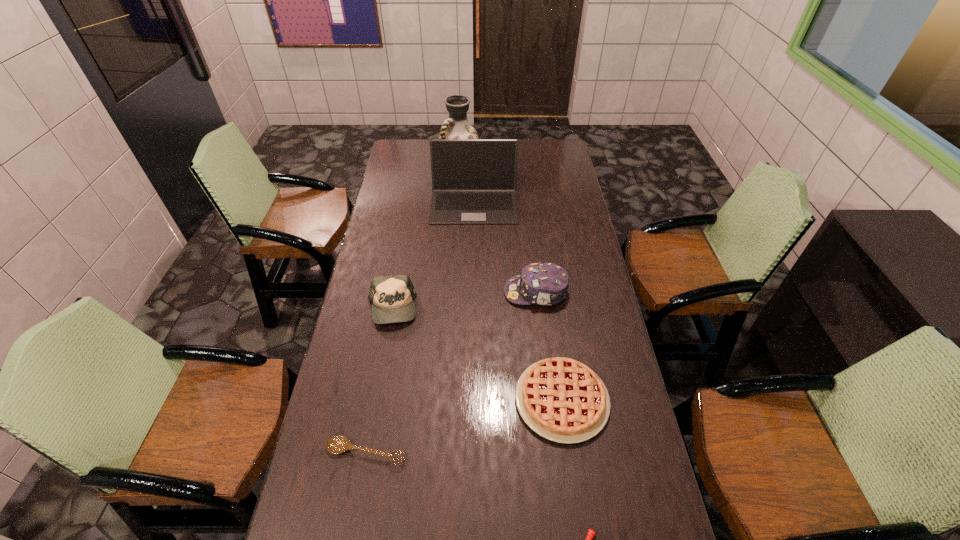
This screenshot has width=960, height=540. Find the location of `the farthest object`. the farthest object is located at coordinates (456, 126).

Locate an element on the screen. The width and height of the screenshot is (960, 540). the tallest object is located at coordinates (456, 126).

At what (x,y) coordinates should I click in order to perform the action: click on the sixth shortest object. Please return your answer as a coordinate pair (x, y). The image size is (960, 540). Looking at the image, I should click on (473, 180).

Find the location of a particular element. the sixth nearest object is located at coordinates pos(473,180).

Locate an element on the screen. the fifth shortest object is located at coordinates (547, 284).

Find the location of `the fourth shortest object`. the fourth shortest object is located at coordinates pyautogui.click(x=392, y=297).

You are a GUI agent. You are given a task and a screenshot of the screen. Output one action in this format:
    pyautogui.click(x=<x>, y=<y>)
    Task: Click on the third shortest object
    This screenshot has height=540, width=960.
    Given the screenshot: What is the action you would take?
    pyautogui.click(x=561, y=399)

At what (x,y) coordinates should I click in order to perform the action: click on ladle. Please return your answer as a coordinate pair (x, y). The image size is (960, 540). Looking at the image, I should click on (337, 444).

Where is `vacant area situated on the right of the farthest object`? The image size is (960, 540). vacant area situated on the right of the farthest object is located at coordinates (527, 154).

This screenshot has height=540, width=960. Find the location of `vacant space located 0.310m on the screen of the second tallest object`. vacant space located 0.310m on the screen of the second tallest object is located at coordinates click(472, 277).